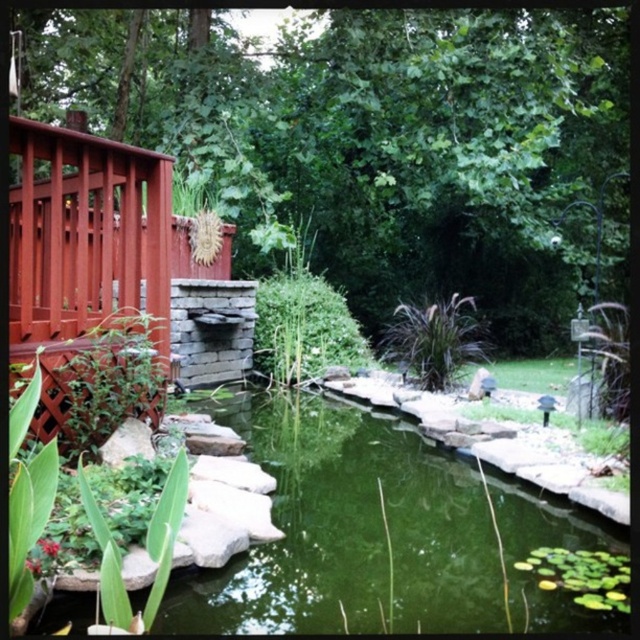
Is dark green grass at center thinner than green leafy lily pads at lower right?

Yes.

Measure the distance from dark green grass at center to green leafy lily pads at lower right.

4.15 meters

Between point (420, 323) and point (579, 595), which one is positioned behind?

The point (420, 323) is behind.

Identify the location of dark green grass at center. (433, 339).

Which is more to the left, green leafy plant at left or green leafy plant at center?

green leafy plant at left is more to the left.

Is green leafy plant at left taller than green leafy plant at center?

Incorrect, green leafy plant at left's height is not larger of green leafy plant at center's.

Where is `green leafy plant at left`? This screenshot has height=640, width=640. green leafy plant at left is located at coordinates (99, 380).

Which of these two, green leafy plant at left or green leafy lily pads at lower right, stands taller?

Standing taller between the two is green leafy plant at left.

Is point (120, 348) less distant than point (556, 586)?

No, it is behind (556, 586).

In order to click on green leafy plant at left in this screenshot , I will do `click(99, 380)`.